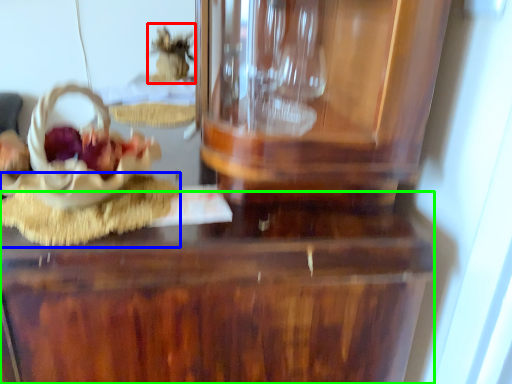
Question: Estimate the real-world distances between objects in this image. Which object is closer to stuff (highlighted by a red box), food (highlighted by a blue box) or table (highlighted by a green box)?

Choices:
 (A) food
 (B) table

Answer: (A)